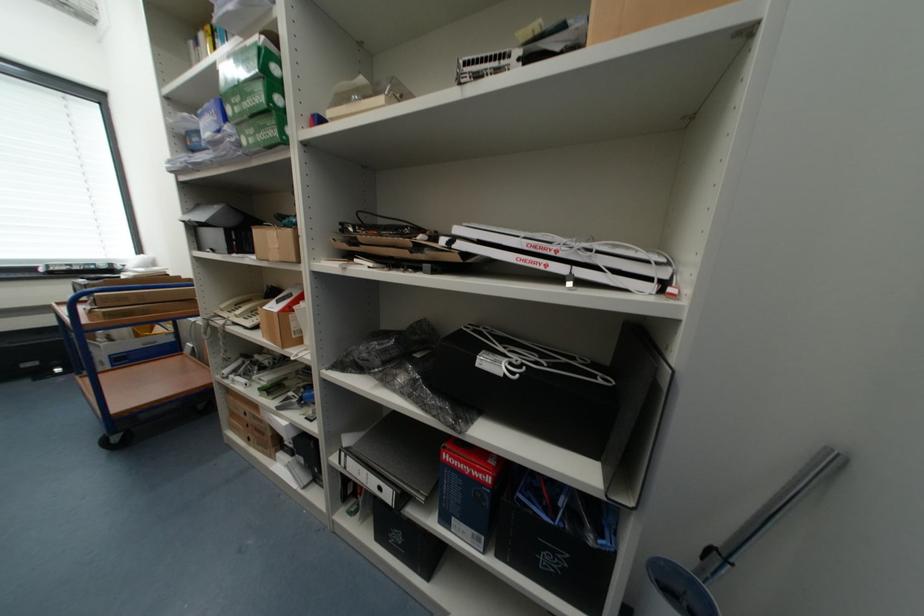
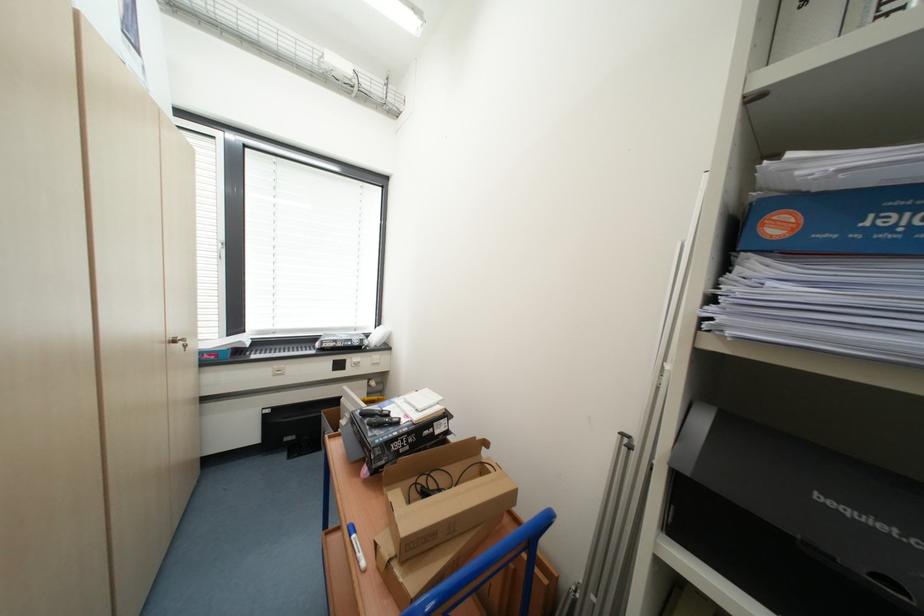
What movement of the cameraman would produce the second image?

The movement direction of the cameraman is left, forward.